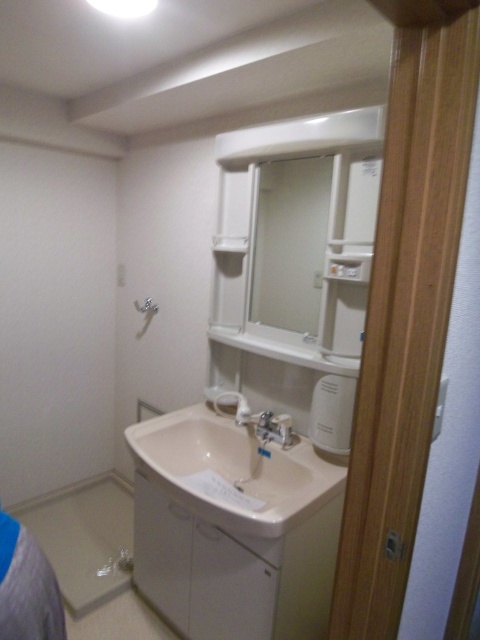
You are a contractor measuring the bathroom layout. You need to determine which object, the white glossy sink at center or the matte white shower at upper center, requires more vertical space for installation. Based on the scene description, which one would you prioritize in terms of height requirements?

The white glossy sink at center is much taller than the matte white shower at upper center, so it requires more vertical space and should be prioritized in terms of height requirements.

From the picture: You are standing in the bathroom and want to wash your hands. Where is the white glossy sink at center located in the room?

The white glossy sink at center is located at the center of the room, positioned at coordinates approximately 0.736 on the x axis and 0.485 on the y axis.

You are standing in the bathroom and need to determine which of the two points, point (x=217, y=509) or point (x=267, y=422), is closer to you. Based on the scene description, which point is nearer?

Point (x=217, y=509) is closer to the viewer than point (x=267, y=422).